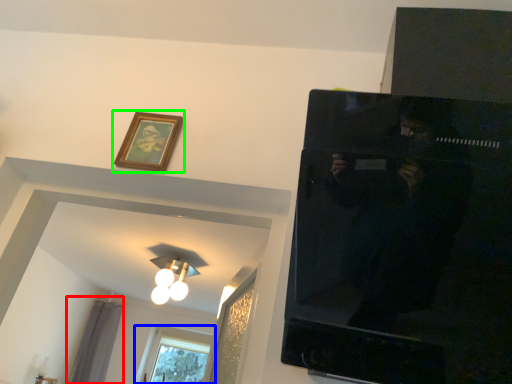
Question: Which object is the closest to the curtain (highlighted by a red box)? Choose among these: window (highlighted by a blue box) or picture frame (highlighted by a green box).

Choices:
 (A) window
 (B) picture frame

Answer: (A)